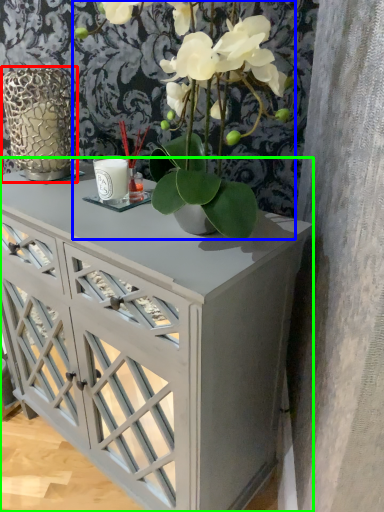
Question: Estimate the real-world distances between objects in this image. Which object is closer to glass vase (highlighted by a red box), houseplant (highlighted by a blue box) or table (highlighted by a green box)?

Choices:
 (A) houseplant
 (B) table

Answer: (A)